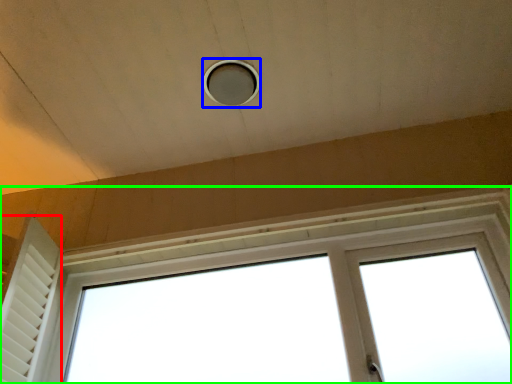
Question: Considering the real-world distances, which object is farthest from shutter (highlighted by a red box)? hole (highlighted by a blue box) or window (highlighted by a green box)?

Choices:
 (A) hole
 (B) window

Answer: (A)